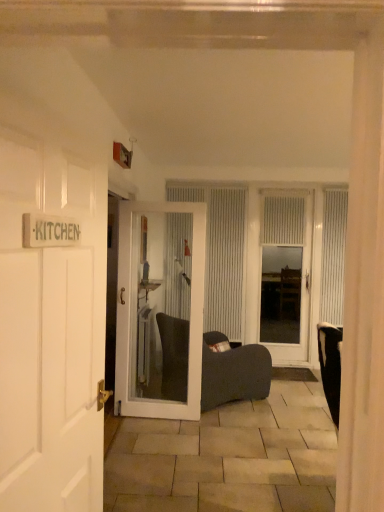
Describe the element at coordinates (333, 256) in the screenshot. The height and width of the screenshot is (512, 384). I see `white textured curtain at right, placed as the first curtain when sorted from right to left` at that location.

How much space does white glossy door at center, placed as the second door when sorted from left to right, occupy vertically?

It is 1.91 meters.

This screenshot has height=512, width=384. What do you see at coordinates (233, 372) in the screenshot?
I see `dark fabric chair at center` at bounding box center [233, 372].

I want to click on dark fabric chair at center, so click(x=233, y=372).

The height and width of the screenshot is (512, 384). What do you see at coordinates (301, 283) in the screenshot?
I see `white glass door at center, which is the 1th door in right-to-left order` at bounding box center [301, 283].

The image size is (384, 512). I want to click on white textured curtain at right, the third curtain viewed from the left, so click(333, 256).

Which object is positioned more to the left, white wooden door at left, the 3th door when ordered from right to left, or dark fabric chair at center?

white wooden door at left, the 3th door when ordered from right to left.

Is dark fabric chair at center completely or partially inside white wooden door at left, acting as the first door starting from the left?

Definitely not — dark fabric chair at center is not inside white wooden door at left, acting as the first door starting from the left.

Find the location of a particular element. This screenshot has width=384, height=512. furniture that appears on the right of white wooden door at left, the 3th door when ordered from right to left is located at coordinates (233, 372).

Are white wooden door at left, the 1th door in the front-to-back sequence, and dark fabric chair at center located far from each other?

Yes, white wooden door at left, the 1th door in the front-to-back sequence, and dark fabric chair at center are quite far apart.

Which is behind, point (342, 195) or point (232, 246)?

The point (342, 195) is behind.

Which is in front, white textured curtain at right, the third curtain viewed from the left, or white textured curtain at center, placed as the third curtain when sorted from right to left?

Positioned in front is white textured curtain at right, the third curtain viewed from the left.

From a real-world perspective, is white textured curtain at right, placed as the first curtain when sorted from right to left, positioned above or below white textured curtain at center, placed as the third curtain when sorted from right to left?

Clearly, from a real-world perspective, white textured curtain at right, placed as the first curtain when sorted from right to left, is above white textured curtain at center, placed as the third curtain when sorted from right to left.

Is white glass door at center, the 3th door positioned from the left, turned away from white textured curtain at right, the third curtain viewed from the left?

No, white glass door at center, the 3th door positioned from the left, is not facing away from white textured curtain at right, the third curtain viewed from the left.

Which is more to the left, white glass door at center, the 3th door positioned from the left, or white textured curtain at right, the third curtain viewed from the left?

white glass door at center, the 3th door positioned from the left.

This screenshot has height=512, width=384. Find the location of `the 2nd curtain located above the white glass door at center, which is the 1th door in right-to-left order (from a real-world perspective)`. the 2nd curtain located above the white glass door at center, which is the 1th door in right-to-left order (from a real-world perspective) is located at coordinates (333, 256).

Based on their sizes in the image, would you say white glass door at center, the first door from the back, is bigger or smaller than white textured curtain at right, the third curtain viewed from the left?

Considering their sizes, white glass door at center, the first door from the back, takes up more space than white textured curtain at right, the third curtain viewed from the left.

In the scene shown: Relative to white textured curtain at center, which ranks as the second curtain in right-to-left order, is white glass door at center, the third door when ordered from front to back, in front or behind?

Clearly, white glass door at center, the third door when ordered from front to back, is in front of white textured curtain at center, which ranks as the second curtain in right-to-left order.

Measure the distance between white glass door at center, which is the 1th door in right-to-left order, and white textured curtain at center, which ranks as the second curtain in right-to-left order.

white glass door at center, which is the 1th door in right-to-left order, is 21.67 inches away from white textured curtain at center, which ranks as the second curtain in right-to-left order.

Is white glass door at center, which is the 1th door in right-to-left order, bigger or smaller than white textured curtain at center, which ranks as the second curtain in right-to-left order?

Considering their sizes, white glass door at center, which is the 1th door in right-to-left order, takes up more space than white textured curtain at center, which ranks as the second curtain in right-to-left order.

Is white glass door at center, the first door from the back, located outside white textured curtain at center, which is the 2th curtain in left-to-right order?

That's incorrect, white glass door at center, the first door from the back, is not completely outside white textured curtain at center, which is the 2th curtain in left-to-right order.

Could you tell me if dark fabric chair at center is turned towards white textured curtain at center, which is the 2th curtain in left-to-right order?

No, dark fabric chair at center is not oriented towards white textured curtain at center, which is the 2th curtain in left-to-right order.

The image size is (384, 512). What are the coordinates of `the 3rd curtain above the dark fabric chair at center (from the image's perspective)` in the screenshot? It's located at (283, 220).

In terms of height, does dark fabric chair at center look taller or shorter compared to white textured curtain at center, which is the 2th curtain in left-to-right order?

In the image, dark fabric chair at center appears to be taller than white textured curtain at center, which is the 2th curtain in left-to-right order.

Find the location of `curtain that is the 2nd object located above the dark fabric chair at center (from the image's perspective)`. curtain that is the 2nd object located above the dark fabric chair at center (from the image's perspective) is located at coordinates (333, 256).

Considering the sizes of white textured curtain at right, placed as the first curtain when sorted from right to left, and dark fabric chair at center in the image, is white textured curtain at right, placed as the first curtain when sorted from right to left, wider or thinner than dark fabric chair at center?

In the image, white textured curtain at right, placed as the first curtain when sorted from right to left, appears to be more narrow than dark fabric chair at center.

Does white textured curtain at right, the third curtain viewed from the left, have a smaller size compared to dark fabric chair at center?

Indeed, white textured curtain at right, the third curtain viewed from the left, has a smaller size compared to dark fabric chair at center.

From the image's perspective, which is below, white textured curtain at right, the third curtain viewed from the left, or dark fabric chair at center?

dark fabric chair at center.

From the image's perspective, which one is positioned higher, white textured curtain at center, which is the 2th curtain in left-to-right order, or dark fabric chair at center?

white textured curtain at center, which is the 2th curtain in left-to-right order.

From a real-world perspective, is white textured curtain at center, which ranks as the second curtain in right-to-left order, over dark fabric chair at center?

Yes.

In terms of size, does white textured curtain at center, which ranks as the second curtain in right-to-left order, appear bigger or smaller than dark fabric chair at center?

Clearly, white textured curtain at center, which ranks as the second curtain in right-to-left order, is smaller in size than dark fabric chair at center.

Which is behind, point (298, 213) or point (180, 374)?

The point (298, 213) is farther from the camera.

Locate an element on the screen. This screenshot has height=512, width=384. furniture that is under the white wooden door at left, the 1th door in the front-to-back sequence (from a real-world perspective) is located at coordinates (233, 372).

In order to click on the 2nd curtain counting from the left of the white textured curtain at right, the third curtain viewed from the left in this screenshot , I will do `click(221, 254)`.

Which object lies further to the anchor point white textured curtain at center, placed as the 1th curtain when sorted from left to right, white glass door at center, the first door from the back, or white glossy door at center, placed as the second door when sorted from left to right?

white glossy door at center, placed as the second door when sorted from left to right, is further to white textured curtain at center, placed as the 1th curtain when sorted from left to right.

Looking at the image, which one is located closer to white textured curtain at center, placed as the 1th curtain when sorted from left to right, white textured curtain at right, placed as the first curtain when sorted from right to left, or white textured curtain at center, which ranks as the second curtain in right-to-left order?

Based on the image, white textured curtain at center, which ranks as the second curtain in right-to-left order, appears to be nearer to white textured curtain at center, placed as the 1th curtain when sorted from left to right.

Estimate the real-world distances between objects in this image. Which object is closer to white glass door at center, which is the 1th door in right-to-left order, white textured curtain at center, which ranks as the second curtain in right-to-left order, or white textured curtain at right, placed as the first curtain when sorted from right to left?

Based on the image, white textured curtain at right, placed as the first curtain when sorted from right to left, appears to be nearer to white glass door at center, which is the 1th door in right-to-left order.

Based on their spatial positions, is white wooden door at left, the 1th door in the front-to-back sequence, or dark fabric chair at center further from white glass door at center, the 3th door positioned from the left?

The object further to white glass door at center, the 3th door positioned from the left, is white wooden door at left, the 1th door in the front-to-back sequence.

When comparing their distances from white textured curtain at center, which is the 2th curtain in left-to-right order, does white textured curtain at center, placed as the 1th curtain when sorted from left to right, or white glossy door at center, the 2th door in the back-to-front sequence, seem closer?

white textured curtain at center, placed as the 1th curtain when sorted from left to right, lies closer to white textured curtain at center, which is the 2th curtain in left-to-right order, than the other object.

From the image, which object appears to be nearer to dark fabric chair at center, white textured curtain at center, which ranks as the second curtain in right-to-left order, or white textured curtain at center, placed as the third curtain when sorted from right to left?

white textured curtain at center, placed as the third curtain when sorted from right to left, lies closer to dark fabric chair at center than the other object.

Estimate the real-world distances between objects in this image. Which object is further from white wooden door at left, the 1th door in the front-to-back sequence, dark fabric chair at center or white textured curtain at center, which is the 2th curtain in left-to-right order?

Among the two, white textured curtain at center, which is the 2th curtain in left-to-right order, is located further to white wooden door at left, the 1th door in the front-to-back sequence.

Estimate the real-world distances between objects in this image. Which object is closer to white textured curtain at center, which ranks as the second curtain in right-to-left order, white glass door at center, the first door from the back, or white glossy door at center, placed as the second door when sorted from left to right?

white glass door at center, the first door from the back, is closer to white textured curtain at center, which ranks as the second curtain in right-to-left order.

This screenshot has height=512, width=384. I want to click on curtain between white wooden door at left, acting as the first door starting from the left, and white glass door at center, the first door from the back, along the z-axis, so click(333, 256).

Locate an element on the screen. This screenshot has height=512, width=384. curtain between dark fabric chair at center and white textured curtain at center, which ranks as the second curtain in right-to-left order, from front to back is located at coordinates (333, 256).

I want to click on furniture between white glossy door at center, placed as the second door when sorted from left to right, and white textured curtain at right, placed as the first curtain when sorted from right to left, in the horizontal direction, so click(233, 372).

Identify the location of door situated between white textured curtain at center, placed as the 1th curtain when sorted from left to right, and white textured curtain at right, the third curtain viewed from the left, from left to right. (301, 283).